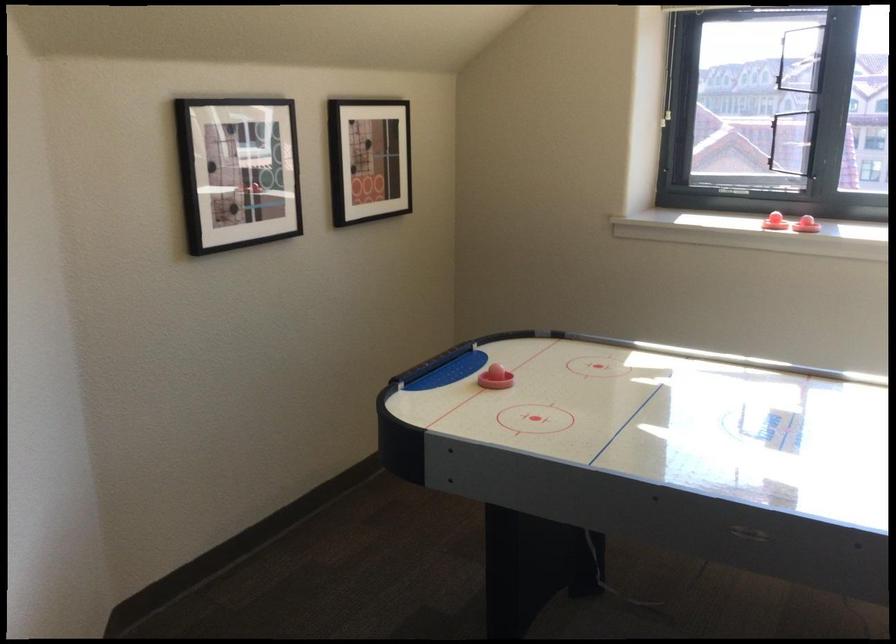
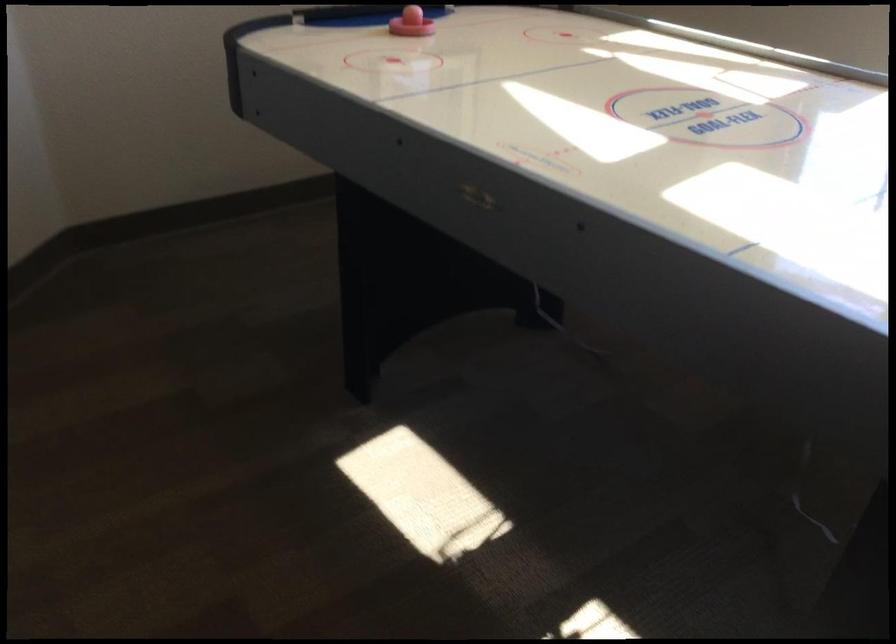
In a continuous first-person perspective shot, in which direction is the camera moving?

The movement direction of the cameraman is right, forward.